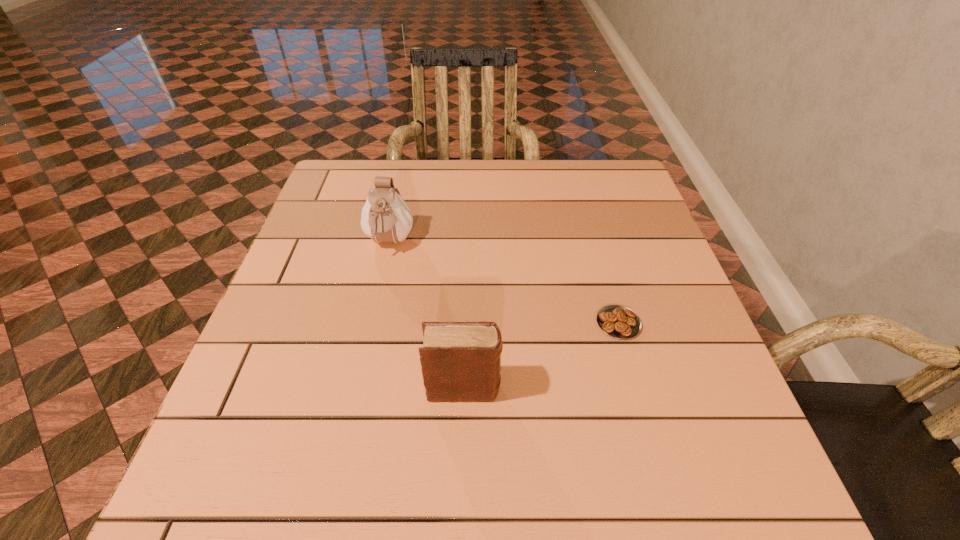
Locate an element on the screen. The width and height of the screenshot is (960, 540). vacant region between the nearest object and the farthest object is located at coordinates (426, 316).

Find the location of a particular element. The width and height of the screenshot is (960, 540). vacant region between the second farthest object and the second object from left to right is located at coordinates (541, 356).

This screenshot has height=540, width=960. In order to click on empty space between the diary and the second nearest object in this screenshot , I will do `click(541, 356)`.

In order to click on free space between the rightmost object and the second object from left to right in this screenshot , I will do `click(541, 356)`.

This screenshot has width=960, height=540. In order to click on vacant space that is in between the second object from left to right and the pouch in this screenshot , I will do `click(426, 316)`.

The height and width of the screenshot is (540, 960). Find the location of `vacant area that lies between the nearest object and the second nearest object`. vacant area that lies between the nearest object and the second nearest object is located at coordinates point(541,356).

Locate which object is the second closest to the diary. Please provide its 2D coordinates. Your answer should be formatted as a tuple, i.e. [(x, y)], where the tuple contains the x and y coordinates of a point satisfying the conditions above.

[(385, 217)]

I want to click on object that can be found as the closest to the pastry, so click(460, 361).

Image resolution: width=960 pixels, height=540 pixels. I want to click on vacant area that satisfies the following two spatial constraints: 1. on the front-facing side of the second nearest object; 2. on the left side of the leftmost object, so click(x=372, y=323).

At what (x,y) coordinates should I click in order to perform the action: click on blank space that satisfies the following two spatial constraints: 1. on the front-facing side of the farthest object; 2. on the left side of the second nearest object. Please return your answer as a coordinate pair (x, y). Looking at the image, I should click on (372, 323).